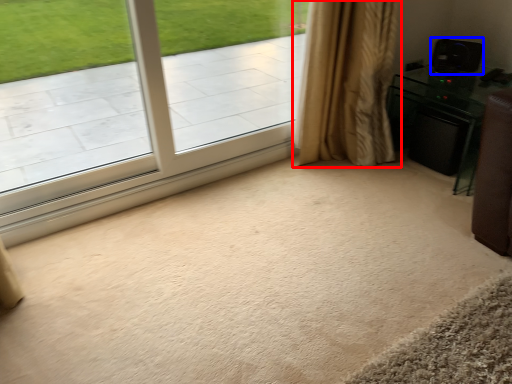
Question: Which object is further to the camera taking this photo, curtain (highlighted by a red box) or speaker (highlighted by a blue box)?

Choices:
 (A) curtain
 (B) speaker

Answer: (B)